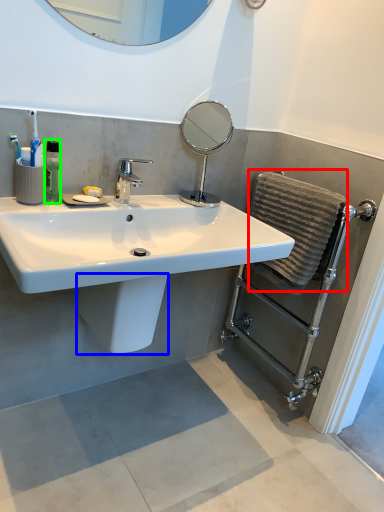
Question: Based on their relative distances, which object is nearer to bath towel (highlighted by a red box)? Choose from bidet (highlighted by a blue box) and mouthwash (highlighted by a green box).

Choices:
 (A) bidet
 (B) mouthwash

Answer: (A)